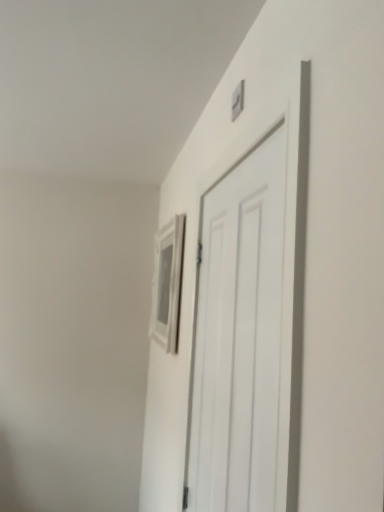
Question: From a real-world perspective, is matte silver picture frame at upper center on white matte door at center?

Choices:
 (A) yes
 (B) no

Answer: (A)

Question: Can you confirm if matte silver picture frame at upper center is positioned to the right of white matte door at center?

Choices:
 (A) yes
 (B) no

Answer: (B)

Question: Does matte silver picture frame at upper center lie in front of white matte door at center?

Choices:
 (A) no
 (B) yes

Answer: (A)

Question: Can you confirm if matte silver picture frame at upper center is bigger than white matte door at center?

Choices:
 (A) yes
 (B) no

Answer: (B)

Question: Is matte silver picture frame at upper center oriented away from white matte door at center?

Choices:
 (A) no
 (B) yes

Answer: (A)

Question: Is matte silver picture frame at upper center aimed at white matte door at center?

Choices:
 (A) yes
 (B) no

Answer: (B)

Question: Can you confirm if white matte door at center is positioned to the right of matte silver picture frame at upper center?

Choices:
 (A) no
 (B) yes

Answer: (B)

Question: Considering the relative sizes of white matte door at center and matte silver picture frame at upper center in the image provided, is white matte door at center smaller than matte silver picture frame at upper center?

Choices:
 (A) no
 (B) yes

Answer: (A)

Question: From a real-world perspective, is white matte door at center below matte silver picture frame at upper center?

Choices:
 (A) yes
 (B) no

Answer: (A)

Question: Is white matte door at center looking in the opposite direction of matte silver picture frame at upper center?

Choices:
 (A) yes
 (B) no

Answer: (B)

Question: Does white matte door at center appear on the left side of matte silver picture frame at upper center?

Choices:
 (A) no
 (B) yes

Answer: (A)

Question: Considering the relative sizes of white matte door at center and matte silver picture frame at upper center in the image provided, is white matte door at center thinner than matte silver picture frame at upper center?

Choices:
 (A) no
 (B) yes

Answer: (B)

Question: Based on their positions, is matte silver picture frame at upper center located to the left or right of white matte door at center?

Choices:
 (A) left
 (B) right

Answer: (A)